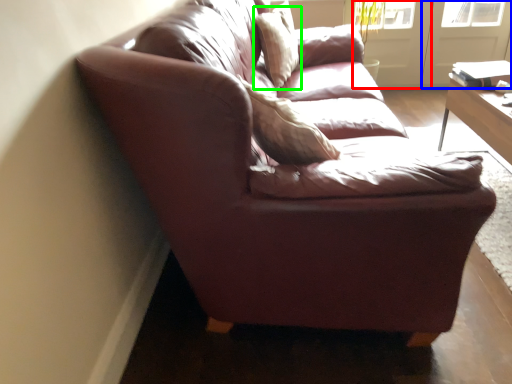
Question: Which object is the closest to the screen door (highlighted by a red box)? Choose among these: screen door (highlighted by a blue box) or pillow (highlighted by a green box).

Choices:
 (A) screen door
 (B) pillow

Answer: (A)